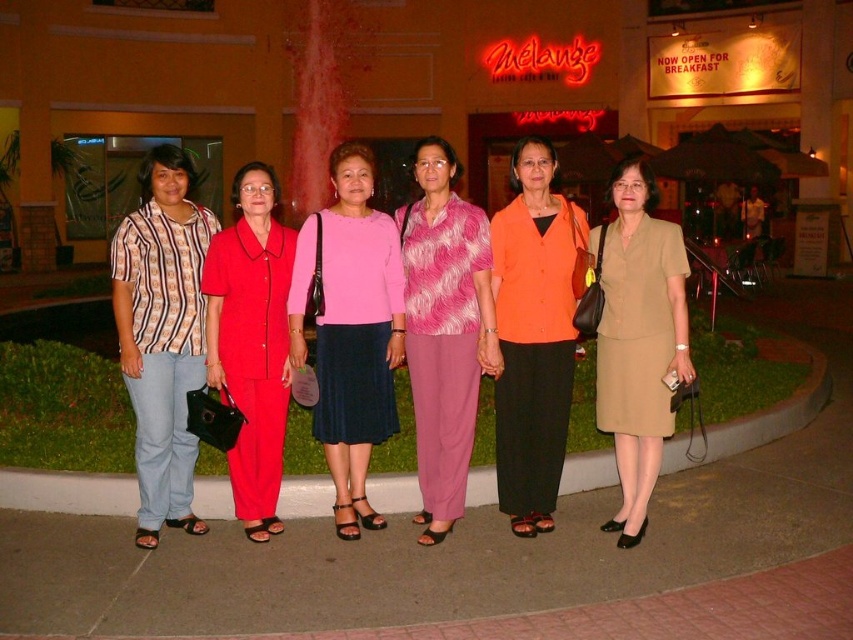
You are a photographer trying to capture a group shot of the beige fabric dress at center and the matte red suit at center. The camera you are using has a lens with a maximum focus range of 6 feet. Will you be able to focus on both subjects simultaneously?

The beige fabric dress at center and the matte red suit at center are 7.08 feet apart from each other. Since the camera lens has a maximum focus range of 6 feet, it cannot focus on both subjects at the same time because the distance between them exceeds the lens capacity.

You are a photographer adjusting the camera settings to ensure all subjects are in focus. The pink fuzzy sweater at center and the beige fabric dress at center are both in the frame. Which clothing item is positioned higher in the image?

The pink fuzzy sweater at center is taller than the beige fabric dress at center, so it is positioned higher in the image.

Based on the photo, you are a photographer trying to determine the correct order of the women from left to right. You see the beige fabric dress at center and the matte red suit at center. Which one is positioned to the left?

The beige fabric dress at center is positioned on the right side of the matte red suit at center, so the matte red suit at center is to the left of the beige fabric dress at center.